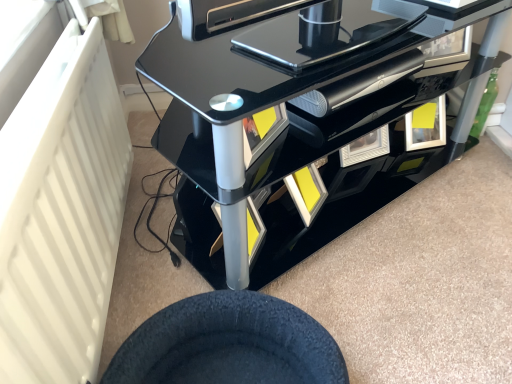
Describe the element at coordinates (228, 344) in the screenshot. I see `black fuzzy wheel at lower center` at that location.

At what (x,y) coordinates should I click in order to perform the action: click on black fuzzy wheel at lower center. Please return your answer as a coordinate pair (x, y). Image resolution: width=512 pixels, height=384 pixels. Looking at the image, I should click on (228, 344).

What is the approximate height of black fuzzy wheel at lower center?

7.46 inches.

At what (x,y) coordinates should I click in order to perform the action: click on glossy black entertainment unit at center. Please return your answer as a coordinate pair (x, y). The image size is (512, 384). Looking at the image, I should click on (293, 119).

The height and width of the screenshot is (384, 512). Describe the element at coordinates (293, 119) in the screenshot. I see `glossy black entertainment unit at center` at that location.

I want to click on black fuzzy wheel at lower center, so click(x=228, y=344).

Is black fuzzy wheel at lower center to the left of glossy black entertainment unit at center from the viewer's perspective?

Correct, you'll find black fuzzy wheel at lower center to the left of glossy black entertainment unit at center.

Is black fuzzy wheel at lower center positioned behind glossy black entertainment unit at center?

No, it is in front of glossy black entertainment unit at center.

Which is less distant, [327,368] or [323,45]?

Point [327,368] is positioned closer to the camera compared to point [323,45].

From the image's perspective, which is above, black fuzzy wheel at lower center or glossy black entertainment unit at center?

glossy black entertainment unit at center.

Consider the image. From a real-world perspective, is black fuzzy wheel at lower center physically located above or below glossy black entertainment unit at center?

In terms of real-world spatial position, black fuzzy wheel at lower center is below glossy black entertainment unit at center.

Does black fuzzy wheel at lower center have a lesser width compared to glossy black entertainment unit at center?

Incorrect, the width of black fuzzy wheel at lower center is not less than that of glossy black entertainment unit at center.

From the picture: Considering the relative sizes of black fuzzy wheel at lower center and glossy black entertainment unit at center in the image provided, is black fuzzy wheel at lower center taller than glossy black entertainment unit at center?

No, black fuzzy wheel at lower center is not taller than glossy black entertainment unit at center.

Is black fuzzy wheel at lower center smaller than glossy black entertainment unit at center?

Yes, black fuzzy wheel at lower center is smaller than glossy black entertainment unit at center.

Can glossy black entertainment unit at center be found inside black fuzzy wheel at lower center?

No, black fuzzy wheel at lower center does not contain glossy black entertainment unit at center.

Is black fuzzy wheel at lower center in contact with glossy black entertainment unit at center?

black fuzzy wheel at lower center and glossy black entertainment unit at center are not in contact.

Is black fuzzy wheel at lower center facing towards glossy black entertainment unit at center?

No, black fuzzy wheel at lower center is not oriented towards glossy black entertainment unit at center.

What's the angular difference between black fuzzy wheel at lower center and glossy black entertainment unit at center's facing directions?

57.5 degrees.

The height and width of the screenshot is (384, 512). In order to click on furniture lying on the right of black fuzzy wheel at lower center in this screenshot , I will do `click(293, 119)`.

Between glossy black entertainment unit at center and black fuzzy wheel at lower center, which one appears on the left side from the viewer's perspective?

From the viewer's perspective, black fuzzy wheel at lower center appears more on the left side.

Based on the photo, which object is more forward, glossy black entertainment unit at center or black fuzzy wheel at lower center?

black fuzzy wheel at lower center is in front.

Which is closer, (372, 189) or (129, 337)?

The point (129, 337) is more forward.

From the image's perspective, which one is positioned higher, glossy black entertainment unit at center or black fuzzy wheel at lower center?

glossy black entertainment unit at center appears higher in the image.

From a real-world perspective, is glossy black entertainment unit at center located higher than black fuzzy wheel at lower center?

Yes, from a real-world perspective, glossy black entertainment unit at center is over black fuzzy wheel at lower center

Does glossy black entertainment unit at center have a lesser width compared to black fuzzy wheel at lower center?

Yes.

Does glossy black entertainment unit at center have a greater height compared to black fuzzy wheel at lower center?

Indeed, glossy black entertainment unit at center has a greater height compared to black fuzzy wheel at lower center.

Which of these two, glossy black entertainment unit at center or black fuzzy wheel at lower center, is smaller?

black fuzzy wheel at lower center.

Would you say black fuzzy wheel at lower center is part of glossy black entertainment unit at center's contents?

No, black fuzzy wheel at lower center is not a part of glossy black entertainment unit at center.

Is there a large distance between glossy black entertainment unit at center and black fuzzy wheel at lower center?

glossy black entertainment unit at center is actually quite close to black fuzzy wheel at lower center.

Is glossy black entertainment unit at center facing away from black fuzzy wheel at lower center?

That's not correct — glossy black entertainment unit at center is not looking away from black fuzzy wheel at lower center.

How different are the orientations of glossy black entertainment unit at center and black fuzzy wheel at lower center in degrees?

The angular difference between glossy black entertainment unit at center and black fuzzy wheel at lower center is 57.5 degrees.

Image resolution: width=512 pixels, height=384 pixels. In order to click on furniture above the black fuzzy wheel at lower center (from a real-world perspective) in this screenshot , I will do `click(293, 119)`.

The width and height of the screenshot is (512, 384). I want to click on furniture above the black fuzzy wheel at lower center (from a real-world perspective), so click(293, 119).

I want to click on wheel on the left of the glossy black entertainment unit at center, so click(228, 344).